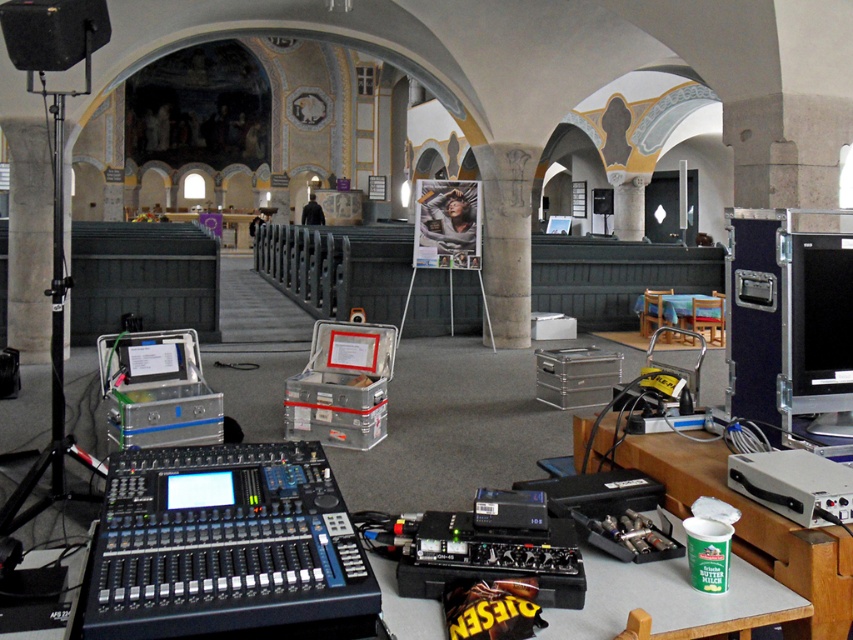
Question: Estimate the real-world distances between objects in this image. Which object is closer to the metallic gray table at lower right?

Choices:
 (A) white plastic cup at lower right
 (B) wooden table at center
 (C) black glossy monitor at right

Answer: (A)

Question: Which object is the closest to the black glossy monitor at right?

Choices:
 (A) wooden table at center
 (B) black plastic mixing console at center
 (C) metallic gray table at lower right

Answer: (C)

Question: Is black glossy monitor at right above wooden table at center?

Choices:
 (A) yes
 (B) no

Answer: (B)

Question: Observing the image, what is the correct spatial positioning of metallic gray table at lower right in reference to black glossy monitor at right?

Choices:
 (A) below
 (B) above

Answer: (A)

Question: Which object is closer to the camera taking this photo?

Choices:
 (A) wooden table at center
 (B) metallic gray table at lower right
 (C) black plastic mixing console at center

Answer: (C)

Question: Is black plastic mixing console at center smaller than white plastic cup at lower right?

Choices:
 (A) yes
 (B) no

Answer: (A)